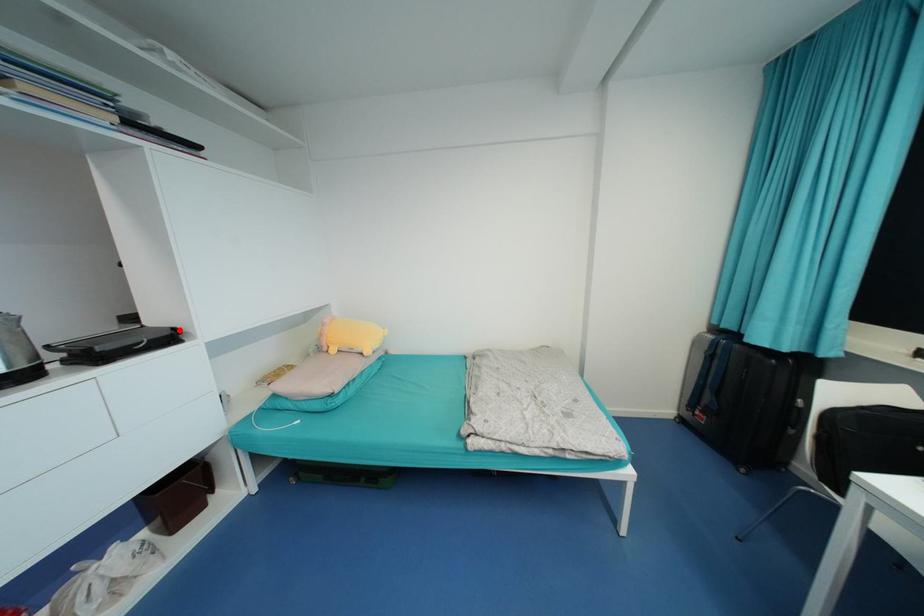
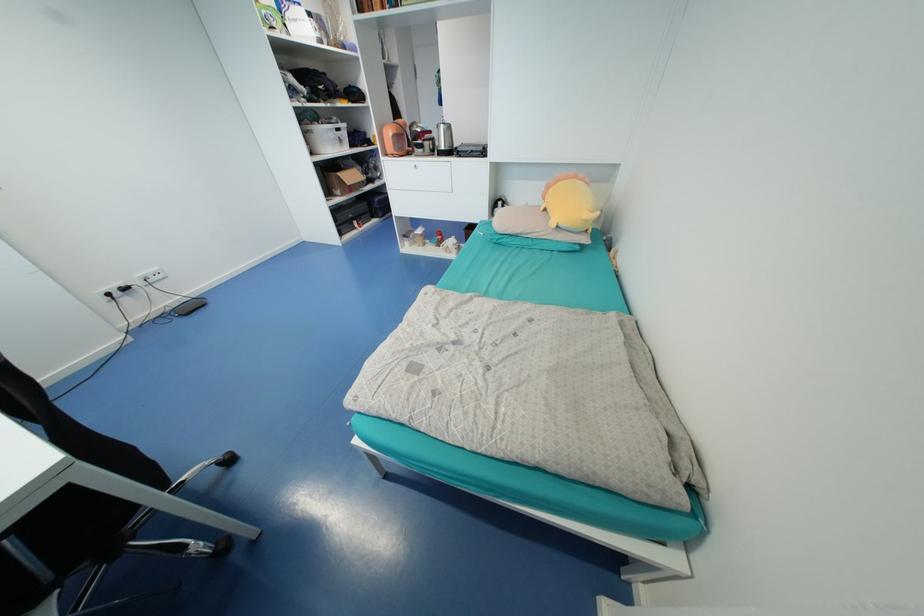
Question: I am providing you with two images of the same scene from different viewpoints. A red point is marked on the first image. At the location where the point appears in image 1, is it still visible in image 2?

Choices:
 (A) Yes
 (B) No

Answer: (B)